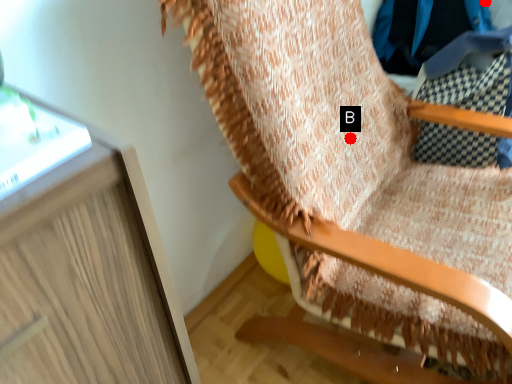
Question: Two points are circled on the image, labeled by A and B beside each circle. Which point appears farthest from the camera in this image?

Choices:
 (A) A is further
 (B) B is further

Answer: (A)